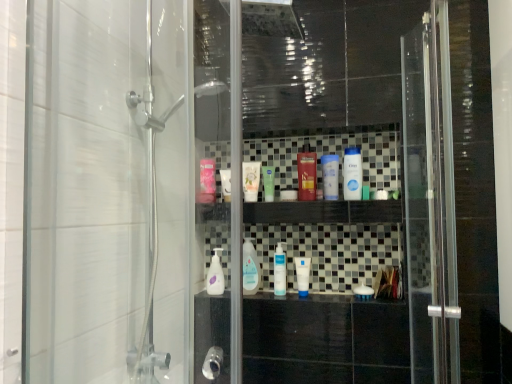
Question: From a real-world perspective, is white glossy mouthwash at center, which appears as the fourth mouthwash when viewed from the right, positioned above or below pink glossy mouthwash at center, marked as the first mouthwash in a left-to-right arrangement?

Choices:
 (A) below
 (B) above

Answer: (A)

Question: Looking at the image, does white glossy mouthwash at center, marked as the 4th mouthwash in a left-to-right arrangement, seem bigger or smaller compared to pink glossy mouthwash at center, acting as the seventh mouthwash starting from the right?

Choices:
 (A) big
 (B) small

Answer: (B)

Question: Estimate the real-world distances between objects in this image. Which object is farther from the clear plastic mouthwash at center, acting as the 6th mouthwash starting from the right?

Choices:
 (A) blue plastic mouthwash at center, the sixth mouthwash viewed from the left
 (B) transparent glass screen door at center
 (C) shiny red plastic bottle at center, the third mouthwash viewed from the right
 (D) white matte tube at center, the 1th toiletry viewed from the top
 (E) green matte tube at center, the fifth mouthwash when ordered from right to left

Answer: (B)

Question: Estimate the real-world distances between objects in this image. Which object is farther from the white glossy mouthwash at center, marked as the 4th mouthwash in a left-to-right arrangement?

Choices:
 (A) white matte tube at center, the 1th toiletry viewed from the top
 (B) green matte tube at center, placed as the third mouthwash when sorted from left to right
 (C) shiny red plastic bottle at center, arranged as the fifth mouthwash when viewed from the left
 (D) blue plastic mouthwash at center, the 2th mouthwash when ordered from right to left
 (E) pink glossy mouthwash at center, acting as the seventh mouthwash starting from the right

Answer: (E)